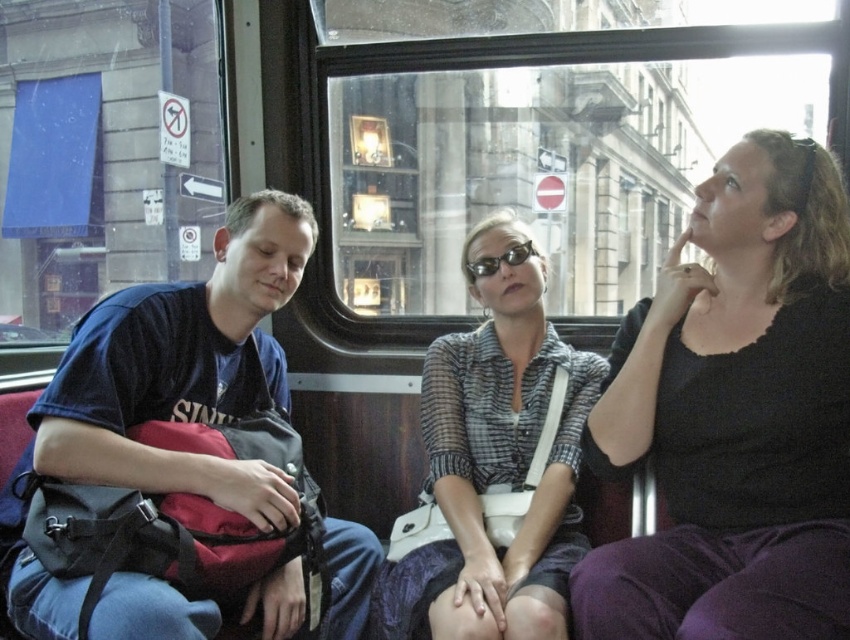
Between black matte shirt at upper right and matte blue shirt at left, which one is positioned lower?

matte blue shirt at left

Is black matte shirt at upper right to the left of matte blue shirt at left from the viewer's perspective?

No, black matte shirt at upper right is not to the left of matte blue shirt at left.

This screenshot has height=640, width=850. What do you see at coordinates (735, 416) in the screenshot?
I see `black matte shirt at upper right` at bounding box center [735, 416].

Identify the location of black matte shirt at upper right. (735, 416).

Does plaid shirt at center have a greater height compared to black plastic sunglasses at center?

Correct, plaid shirt at center is much taller as black plastic sunglasses at center.

Is point (531, 353) more distant than point (496, 262)?

Yes, it is.

Who is more distant from viewer, (x=553, y=460) or (x=513, y=253)?

The point (x=513, y=253) is more distant.

Identify the location of plaid shirt at center. Image resolution: width=850 pixels, height=640 pixels. (494, 465).

Can you confirm if matte blue shirt at left is wider than black plastic sunglasses at center?

Yes.

Between matte blue shirt at left and black plastic sunglasses at center, which one is positioned higher?

black plastic sunglasses at center

Is point (191, 371) behind point (476, 259)?

No, it is not.

Locate an element on the screen. This screenshot has height=640, width=850. matte blue shirt at left is located at coordinates [x=163, y=394].